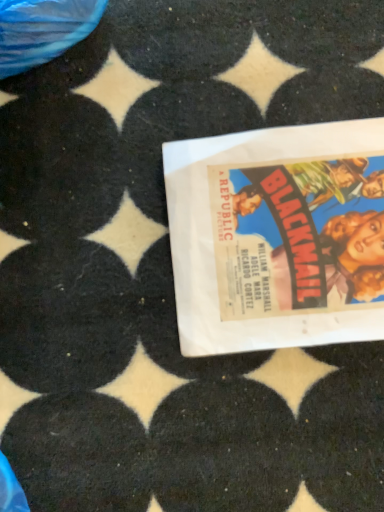
What do you see at coordinates (278, 237) in the screenshot? Image resolution: width=384 pixels, height=512 pixels. I see `matte paper poster at center` at bounding box center [278, 237].

Find the location of a particular element. matte paper poster at center is located at coordinates (278, 237).

Where is `matte paper poster at center`? matte paper poster at center is located at coordinates (278, 237).